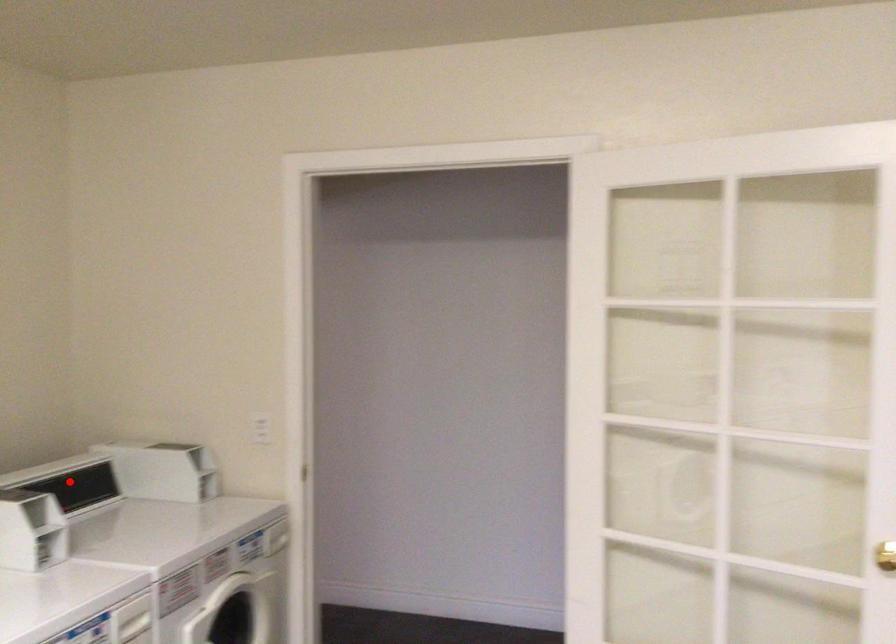
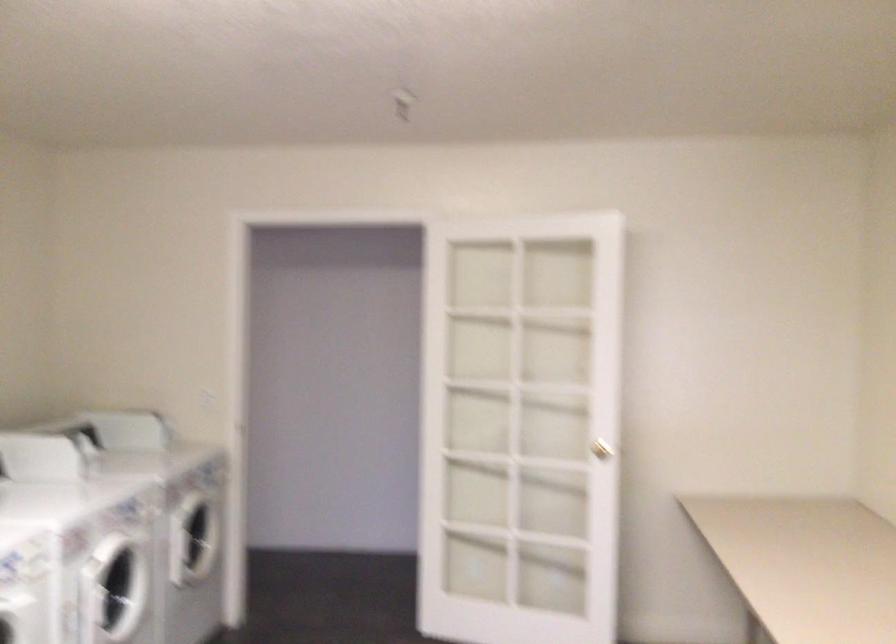
Question: I am providing you with two images of the same scene from different viewpoints. A red point is marked on the first image. Is the red point's position out of view in image 2?

Choices:
 (A) Yes
 (B) No

Answer: (A)